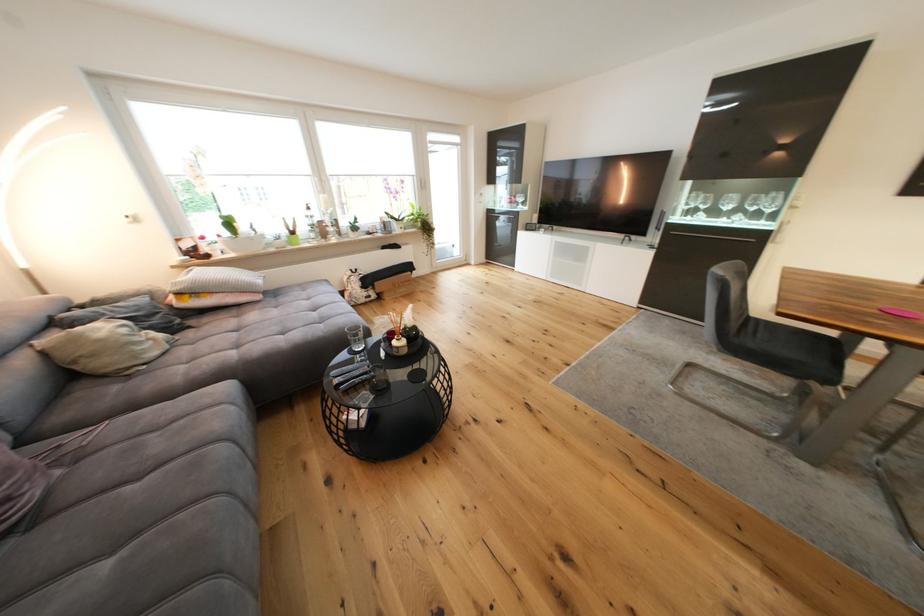
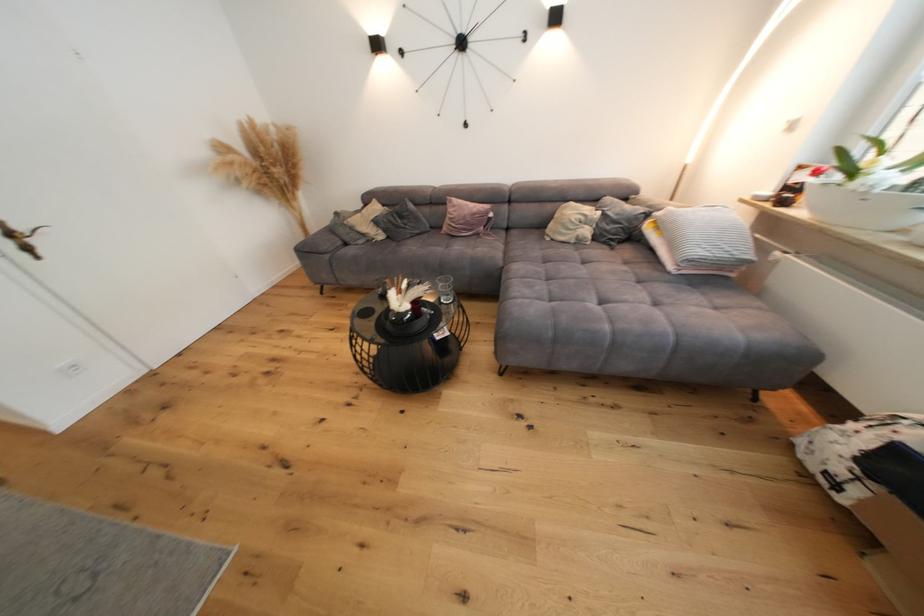
Find the pixel in the second image that matches pixel 289 334 in the first image.

(553, 282)